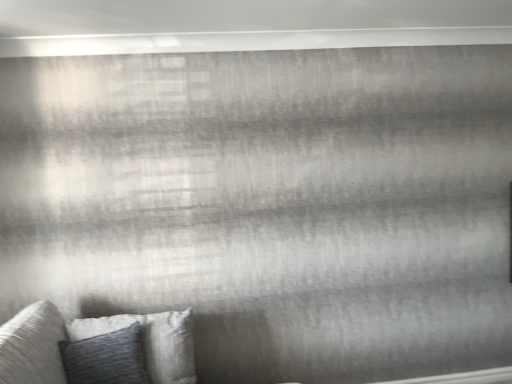
Question: Should I look upward or downward to see textured gray pillow at lower left?

Choices:
 (A) down
 (B) up

Answer: (A)